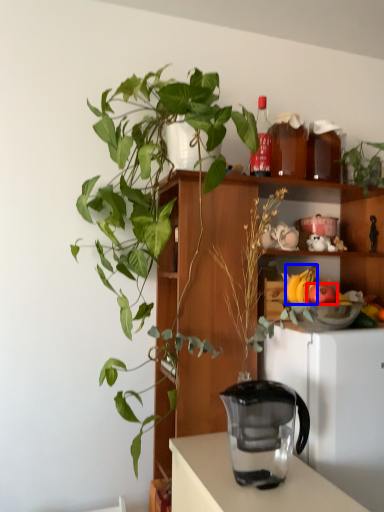
Question: Which object appears closest to the camera in this image, apple (highlighted by a red box) or banana (highlighted by a blue box)?

Choices:
 (A) apple
 (B) banana

Answer: (A)